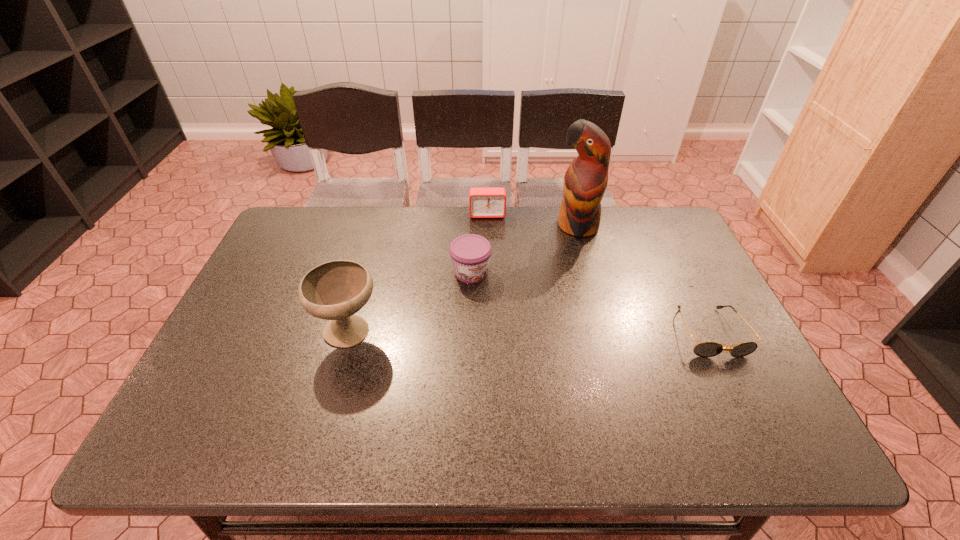
At what (x,y) coordinates should I click in order to perform the action: click on the second tallest object. Please return your answer as a coordinate pair (x, y). The height and width of the screenshot is (540, 960). Looking at the image, I should click on (335, 290).

Locate an element on the screen. the leftmost object is located at coordinates (335, 290).

The width and height of the screenshot is (960, 540). I want to click on the shortest object, so click(x=705, y=349).

Locate an element on the screen. the rightmost object is located at coordinates (705, 349).

Find the location of `the third farthest object`. the third farthest object is located at coordinates (470, 254).

The width and height of the screenshot is (960, 540). In order to click on alarm clock in this screenshot , I will do `click(483, 202)`.

Find the location of `the tallest object`. the tallest object is located at coordinates (585, 181).

Find the location of `parrot`. parrot is located at coordinates (585, 181).

I want to click on vacant space situated on the back of the chalice, so click(x=376, y=237).

At what (x,y) coordinates should I click in order to perform the action: click on vacant area situated 0.130m on the front-facing side of the shortest object. Please return your answer as a coordinate pair (x, y). Looking at the image, I should click on (747, 408).